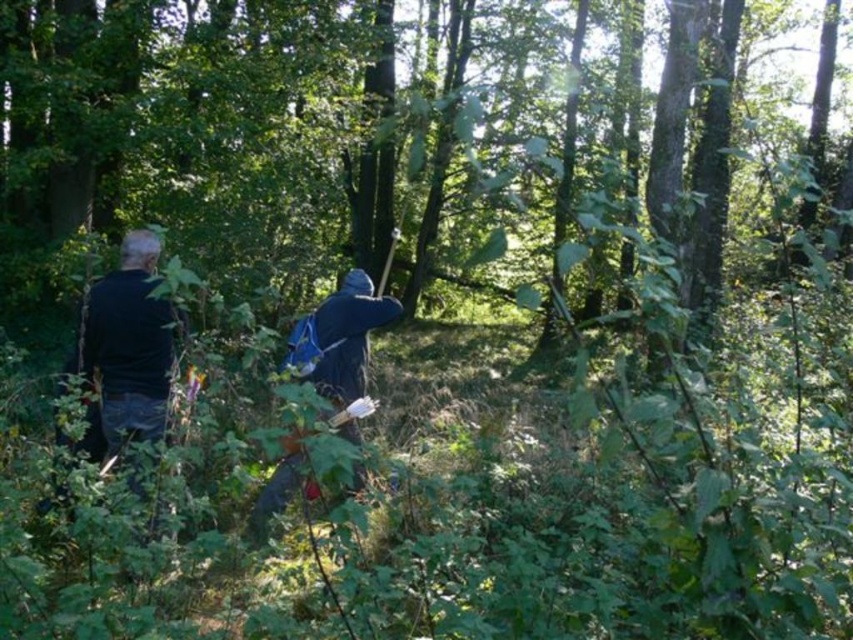
Does point (155, 403) come in front of point (386, 323)?

Yes, it is.

Does black matte jacket at left have a lesser height compared to dark blue hooded cloak at center?

No.

Describe the element at coordinates (128, 346) in the screenshot. The width and height of the screenshot is (853, 640). I see `black matte jacket at left` at that location.

The image size is (853, 640). Find the location of `black matte jacket at left`. black matte jacket at left is located at coordinates (128, 346).